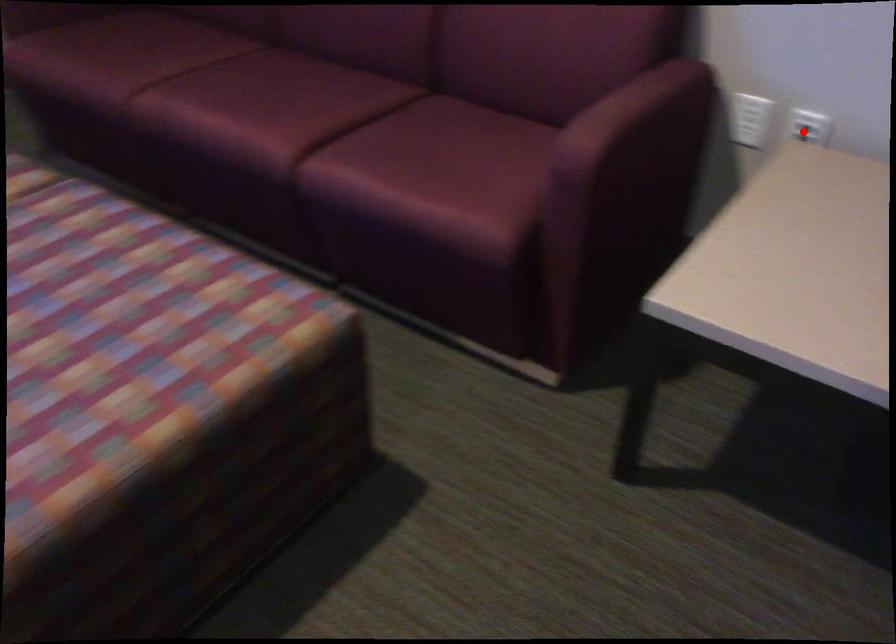
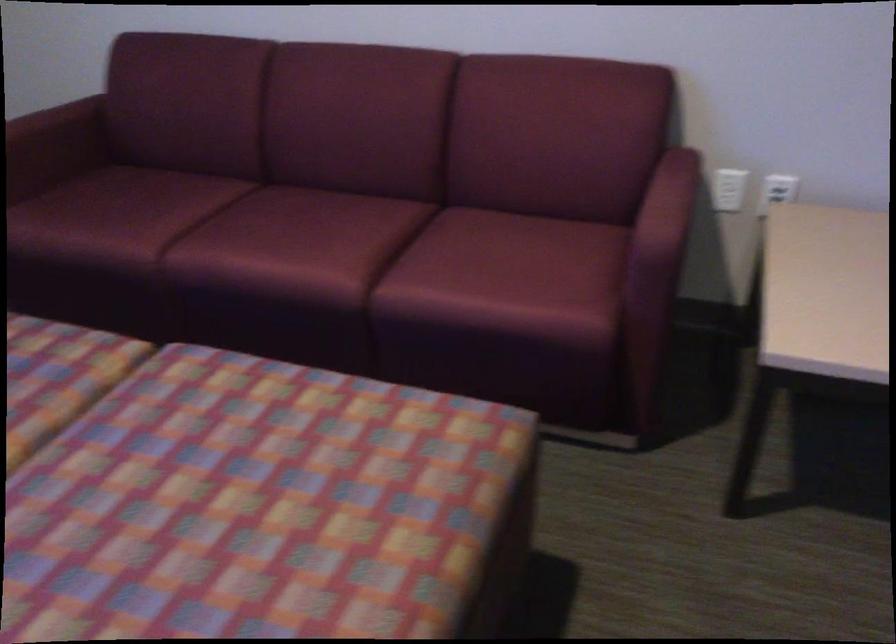
Find the pixel in the second image that matches the highlighted location in the first image.

(777, 190)